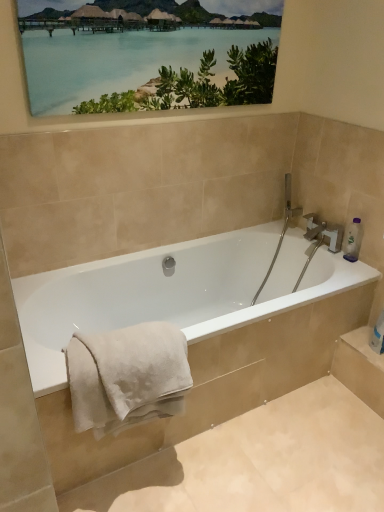
This screenshot has width=384, height=512. Find the location of `free space on the front side of clear plastic bottle at upper right`. free space on the front side of clear plastic bottle at upper right is located at coordinates (355, 269).